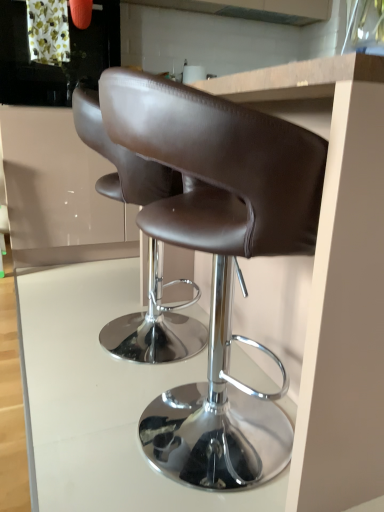
Question: Is brown leather stool at center, which is counted as the 1th chair, starting from the front, turned away from matte white cabinet at upper left?

Choices:
 (A) no
 (B) yes

Answer: (A)

Question: Is brown leather stool at center, which appears as the second chair when viewed from the back, outside of matte white cabinet at upper left?

Choices:
 (A) yes
 (B) no

Answer: (A)

Question: From a real-world perspective, is brown leather stool at center, which is counted as the 1th chair, starting from the front, below matte white cabinet at upper left?

Choices:
 (A) yes
 (B) no

Answer: (A)

Question: Is brown leather stool at center, which is counted as the 1th chair, starting from the front, directly adjacent to matte white cabinet at upper left?

Choices:
 (A) yes
 (B) no

Answer: (B)

Question: Considering the relative positions of brown leather stool at center, which appears as the second chair when viewed from the back, and matte white cabinet at upper left in the image provided, is brown leather stool at center, which appears as the second chair when viewed from the back, in front of matte white cabinet at upper left?

Choices:
 (A) no
 (B) yes

Answer: (B)

Question: From a real-world perspective, is brown leather stool at center, which appears as the second chair when viewed from the back, located higher than matte white cabinet at upper left?

Choices:
 (A) yes
 (B) no

Answer: (B)

Question: Would you consider white glossy table at center to be distant from brown leather stool at center, which appears as the 1th chair when viewed from the back?

Choices:
 (A) yes
 (B) no

Answer: (B)

Question: Does white glossy table at center appear on the right side of brown leather stool at center, acting as the second chair starting from the front?

Choices:
 (A) no
 (B) yes

Answer: (A)

Question: Is white glossy table at center positioned beyond the bounds of brown leather stool at center, acting as the second chair starting from the front?

Choices:
 (A) no
 (B) yes

Answer: (B)

Question: Is brown leather stool at center, acting as the second chair starting from the front, completely or partially inside white glossy table at center?

Choices:
 (A) no
 (B) yes

Answer: (A)

Question: Can you confirm if white glossy table at center is positioned to the left of brown leather stool at center, which appears as the 1th chair when viewed from the back?

Choices:
 (A) no
 (B) yes

Answer: (B)

Question: Is white glossy table at center turned away from brown leather stool at center, which appears as the 1th chair when viewed from the back?

Choices:
 (A) yes
 (B) no

Answer: (B)

Question: Can you confirm if white glossy table at center is shorter than matte white cabinet at upper left?

Choices:
 (A) yes
 (B) no

Answer: (A)